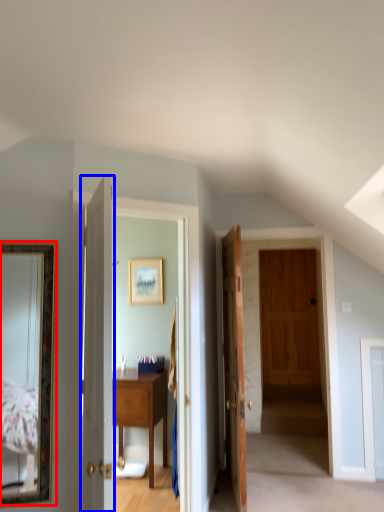
Question: Which point is closer to the camera, mirror (highlighted by a red box) or door (highlighted by a blue box)?

Choices:
 (A) mirror
 (B) door

Answer: (B)